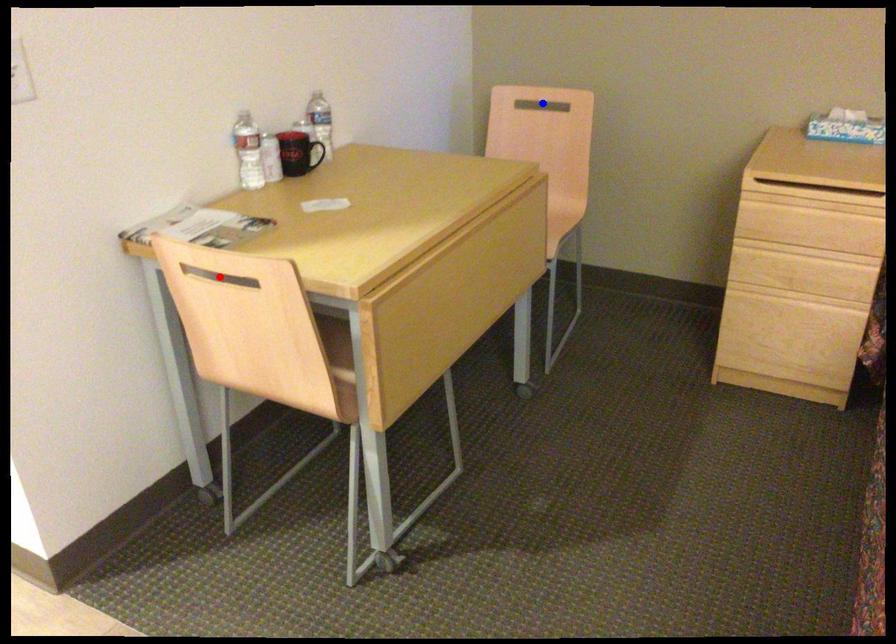
Question: Which of the two points in the image is closer to the camera?

Choices:
 (A) Blue point is closer.
 (B) Red point is closer.

Answer: (B)